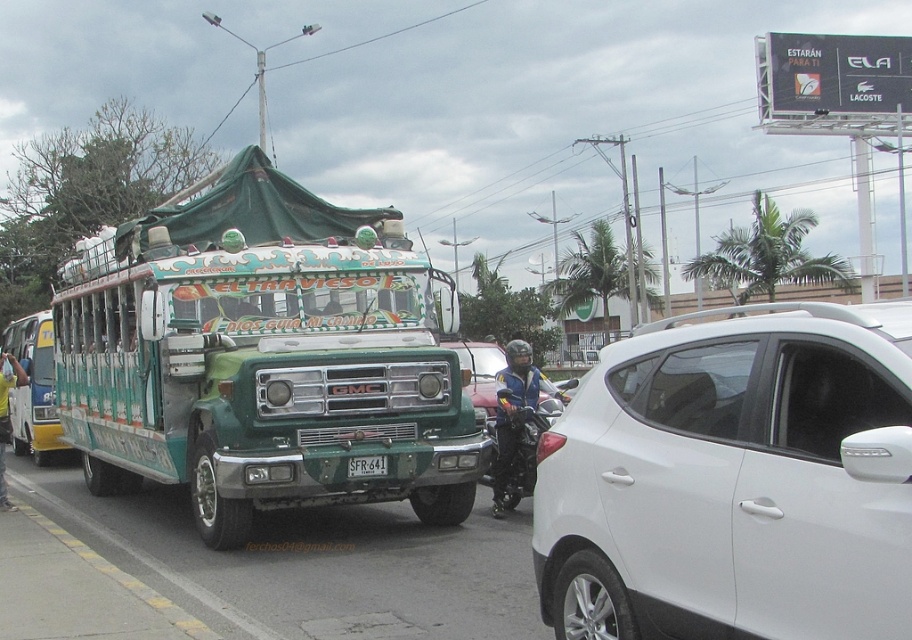
In the scene shown: Is green matte bus at center shorter than yellow fabric shirt at left?

In fact, green matte bus at center may be taller than yellow fabric shirt at left.

Consider the image. Measure the distance between point (397, 314) and camera.

A distance of 30.32 feet exists between point (397, 314) and camera.

Identify the location of green matte bus at center. The height and width of the screenshot is (640, 912). (267, 380).

Locate an element on the screen. white matte suv at center is located at coordinates (734, 481).

Can you confirm if white matte suv at center is positioned below yellow fabric shirt at left?

No, white matte suv at center is not below yellow fabric shirt at left.

Is point (753, 625) behind point (8, 381)?

No, (753, 625) is closer to viewer.

The width and height of the screenshot is (912, 640). Identify the location of white matte suv at center. (734, 481).

Is green matte bus at left shorter than white plastic license plate at center?

No, green matte bus at left is not shorter than white plastic license plate at center.

Does green matte bus at left have a greater width compared to white plastic license plate at center?

Indeed, green matte bus at left has a greater width compared to white plastic license plate at center.

Describe the element at coordinates (33, 387) in the screenshot. The image size is (912, 640). I see `green matte bus at left` at that location.

What are the coordinates of `green matte bus at left` in the screenshot? It's located at (33, 387).